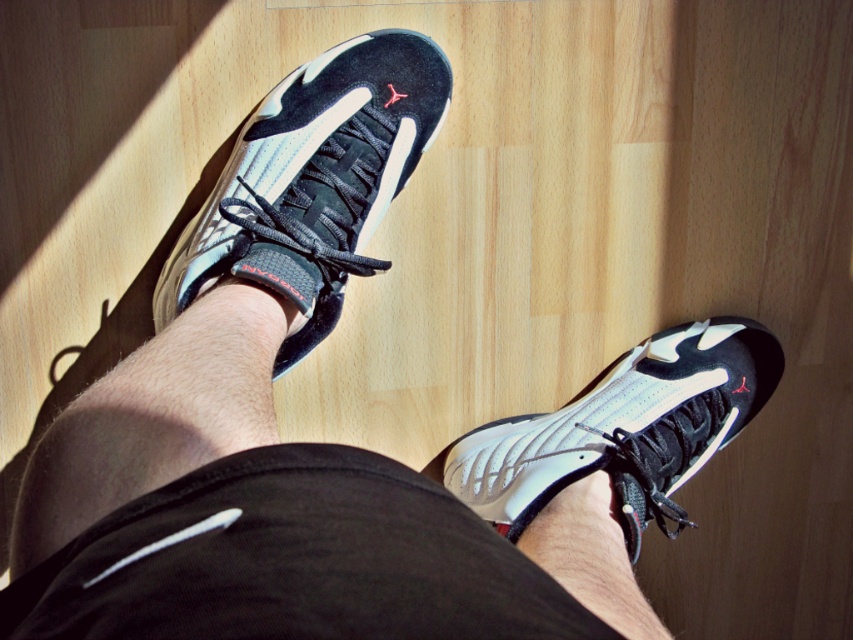
Question: Among these points, which one is farthest from the camera?

Choices:
 (A) (694, 394)
 (B) (404, 115)

Answer: (A)

Question: Can you confirm if white matte running shoe at center is positioned to the left of white matte sneaker at lower right?

Choices:
 (A) no
 (B) yes

Answer: (B)

Question: Is white matte running shoe at center closer to camera compared to white matte sneaker at lower right?

Choices:
 (A) yes
 (B) no

Answer: (A)

Question: Which point is farther to the camera?

Choices:
 (A) white matte running shoe at center
 (B) white matte sneaker at lower right

Answer: (B)

Question: Can you confirm if white matte running shoe at center is bigger than white matte sneaker at lower right?

Choices:
 (A) no
 (B) yes

Answer: (A)